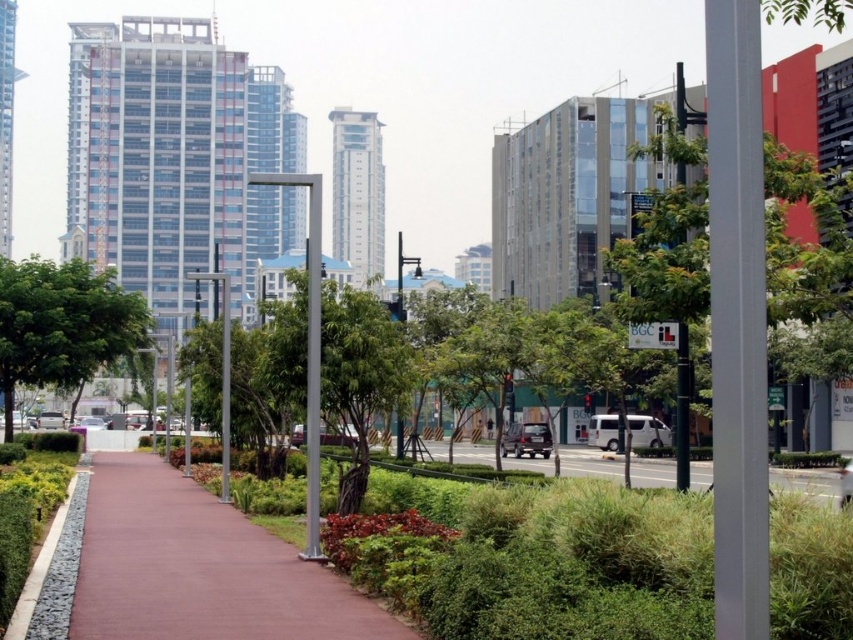
Question: Which point is closer to the camera taking this photo?

Choices:
 (A) (787, 257)
 (B) (814, 492)
 (C) (347, 609)

Answer: (C)

Question: Which point is closer to the camera taking this photo?

Choices:
 (A) (167, 529)
 (B) (1, 364)

Answer: (A)

Question: Is green leafy tree at center-right below green grass at center?

Choices:
 (A) no
 (B) yes

Answer: (A)

Question: Which object is the farthest from the green leafy tree at center-right?

Choices:
 (A) brown rubber pavement at center
 (B) green leafy tree at left
 (C) green grass at center

Answer: (B)

Question: Can you confirm if green leafy tree at center-right is positioned to the right of green grass at center?

Choices:
 (A) yes
 (B) no

Answer: (A)

Question: Can you confirm if brown rubber pavement at center is positioned below green leafy tree at center-right?

Choices:
 (A) yes
 (B) no

Answer: (A)